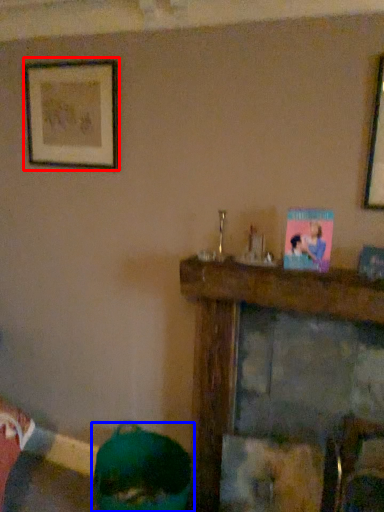
Question: Which object is closer to the camera taking this photo, picture frame (highlighted by a red box) or person (highlighted by a blue box)?

Choices:
 (A) picture frame
 (B) person

Answer: (B)